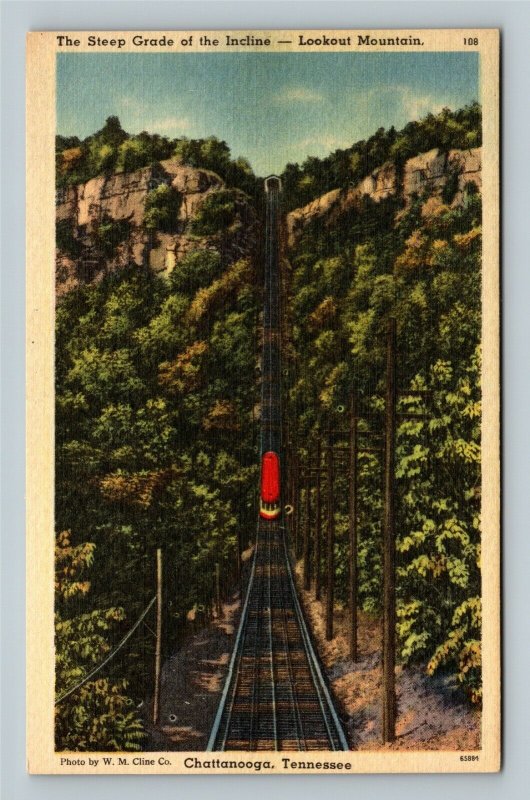
Where is `tan frame`? tan frame is located at coordinates (405, 761).